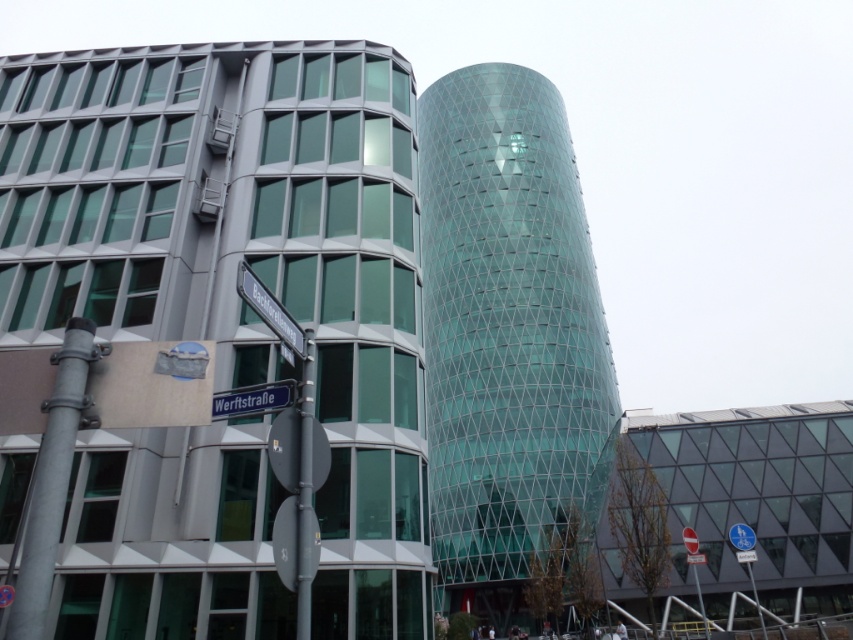
Is point (311, 518) less distant than point (244, 268)?

No, (311, 518) is behind (244, 268).

Between point (309, 564) and point (299, 353), which one is positioned behind?

The point (299, 353) is behind.

You are a GUI agent. You are given a task and a screenshot of the screen. Output one action in this format:
    pyautogui.click(x=<x>, y=<y>)
    Task: Click on the metallic pole at center
    This screenshot has width=853, height=640.
    Given the screenshot: What is the action you would take?
    pyautogui.click(x=305, y=490)

How much distance is there between metallic pole at center and blue metallic street sign at lower center?

metallic pole at center and blue metallic street sign at lower center are 24.45 inches apart.

Who is shorter, metallic pole at center or blue metallic street sign at lower center?

blue metallic street sign at lower center

At what (x,y) coordinates should I click in order to perform the action: click on metallic pole at center. Please return your answer as a coordinate pair (x, y). The width and height of the screenshot is (853, 640). Looking at the image, I should click on (305, 490).

Identify the location of metallic pole at center. Image resolution: width=853 pixels, height=640 pixels. (305, 490).

Which is in front, point (291, 332) or point (281, 400)?

Point (281, 400) is in front.

Who is higher up, black plastic street sign at upper center or blue metallic street sign at lower center?

black plastic street sign at upper center is higher up.

Is point (244, 264) positioned behind point (236, 403)?

No, it is not.

Where is `black plastic street sign at upper center`? black plastic street sign at upper center is located at coordinates (270, 308).